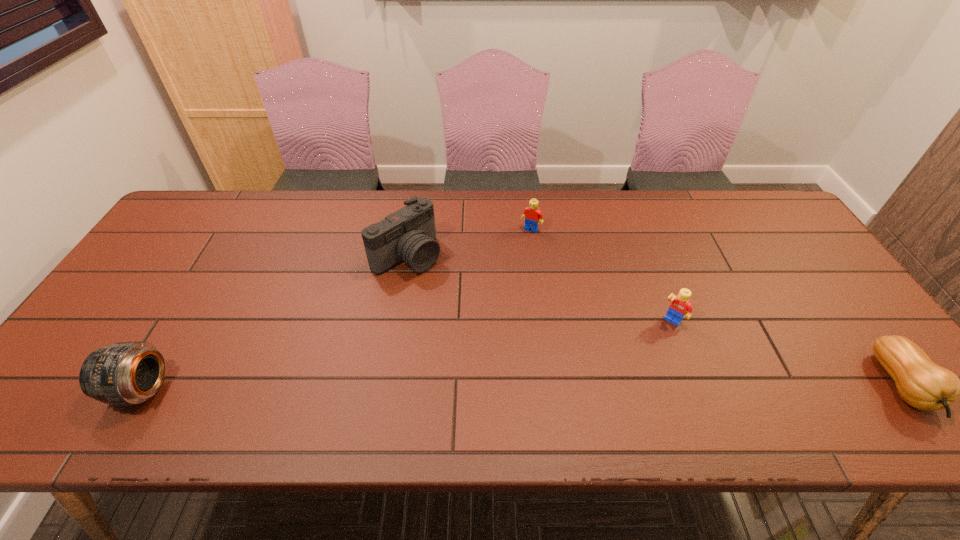
Where is `free spot on the desktop that is between the leftmost object and the gourd and is positioned on the face of the nearer Lego`? free spot on the desktop that is between the leftmost object and the gourd and is positioned on the face of the nearer Lego is located at coordinates (628, 387).

Where is `vacant space on the desktop that is between the leftmost object and the gourd and is positioned at the lens of the camera`? The height and width of the screenshot is (540, 960). vacant space on the desktop that is between the leftmost object and the gourd and is positioned at the lens of the camera is located at coordinates (578, 387).

Find the location of a particular element. This screenshot has height=540, width=960. vacant space on the desktop that is between the telephoto lens and the gourd and is positioned on the face of the left Lego is located at coordinates (430, 388).